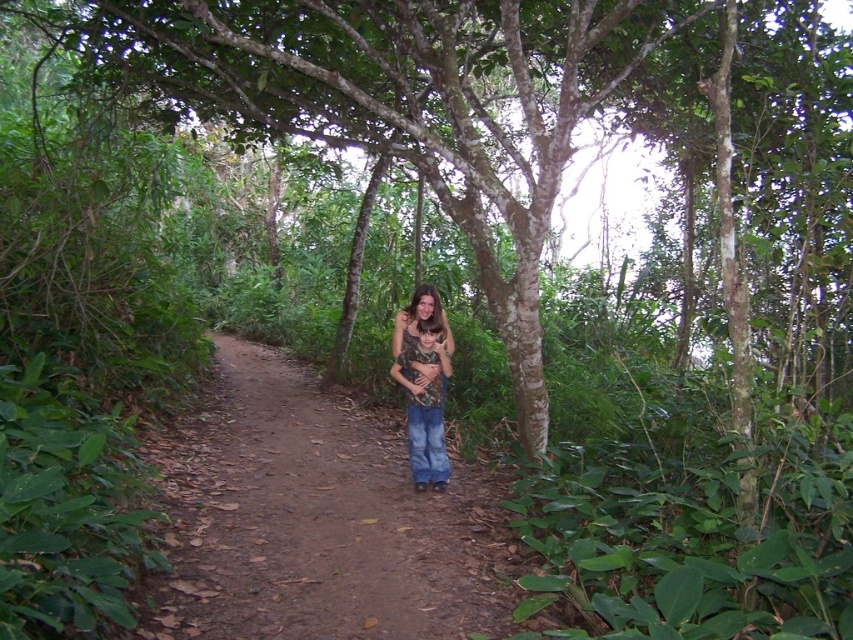
Is point (227, 410) in front of point (431, 356)?

No, (227, 410) is further to viewer.

Based on the photo, who is more distant from viewer, (x=432, y=577) or (x=428, y=397)?

Point (x=428, y=397)

The height and width of the screenshot is (640, 853). I want to click on brown dirt path at center, so click(314, 518).